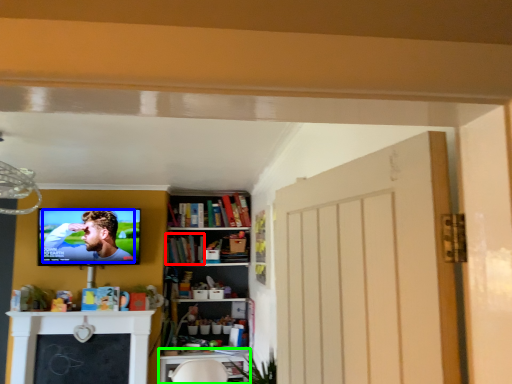
Question: Which is farther away from book (highlighted by a red box)? person (highlighted by a blue box) or table (highlighted by a green box)?

Choices:
 (A) person
 (B) table

Answer: (B)